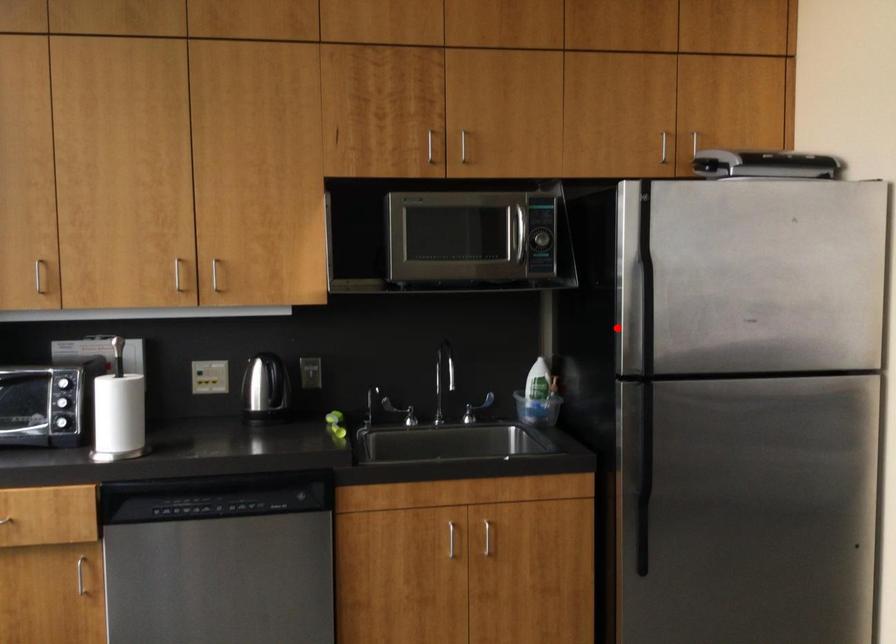
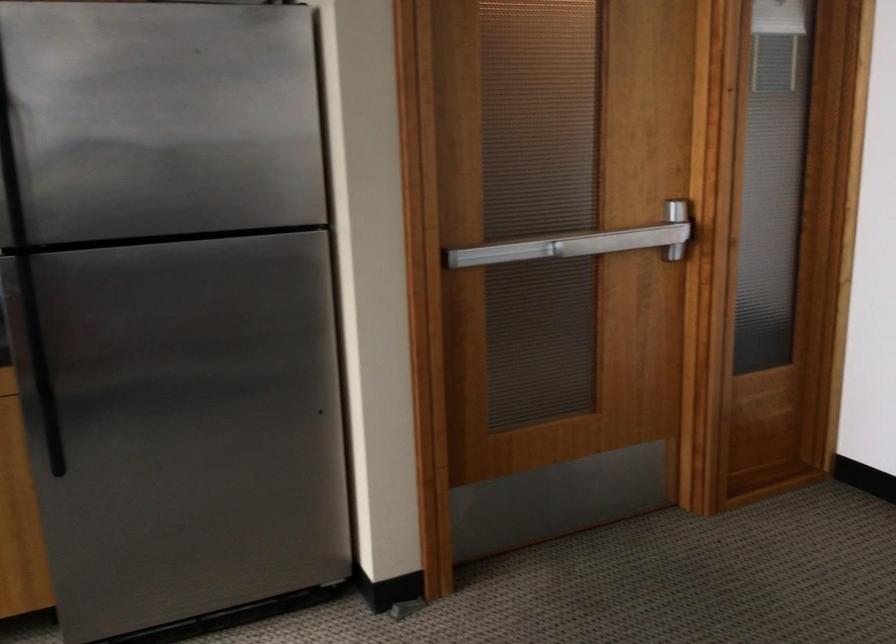
Question: I am providing you with two images of the same scene from different viewpoints. Image1 has a red point marked. In image2, the corresponding 3D location appears at what relative position? Reply with the corresponding letter.

Choices:
 (A) Closer
 (B) Farther

Answer: (A)